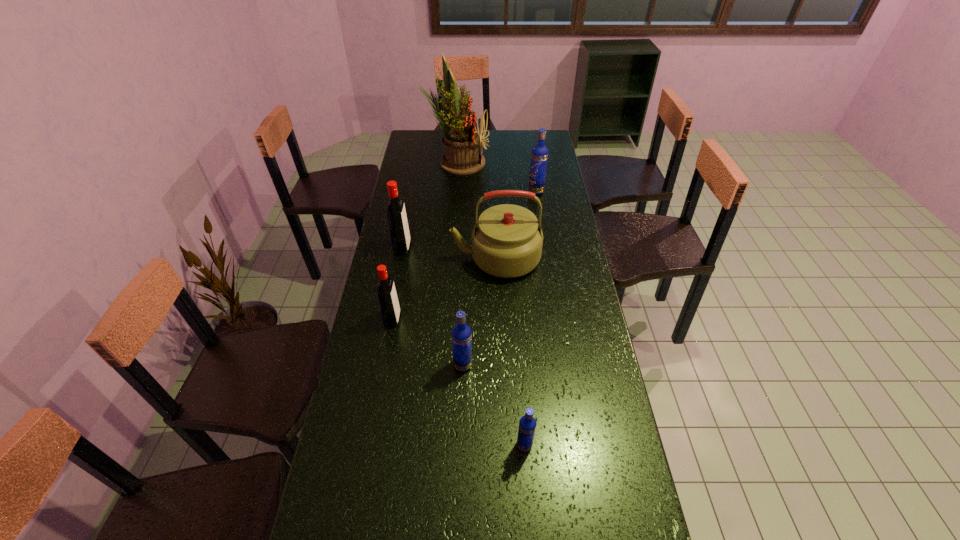
Locate an element on the screen. flower arrangement is located at coordinates (x=461, y=140).

Where is `the tallest object`? The image size is (960, 540). the tallest object is located at coordinates (461, 140).

At what (x,y) coordinates should I click in order to perform the action: click on kettle. Please return your answer as a coordinate pair (x, y). The image size is (960, 540). Looking at the image, I should click on (507, 240).

This screenshot has width=960, height=540. In order to click on the sixth nearest object in this screenshot , I will do `click(539, 156)`.

Locate an element on the screen. This screenshot has height=540, width=960. the rightmost blue vodka is located at coordinates (539, 156).

Where is `the fourth nearest vodka`? The height and width of the screenshot is (540, 960). the fourth nearest vodka is located at coordinates (399, 232).

Locate an element on the screen. the bigger red vodka is located at coordinates (399, 232).

Find the location of a particular element. the third vodka from right to left is located at coordinates (461, 333).

Identify the location of the second nearest vodka. (461, 333).

Identify the location of the fifth farthest object. This screenshot has height=540, width=960. (388, 301).